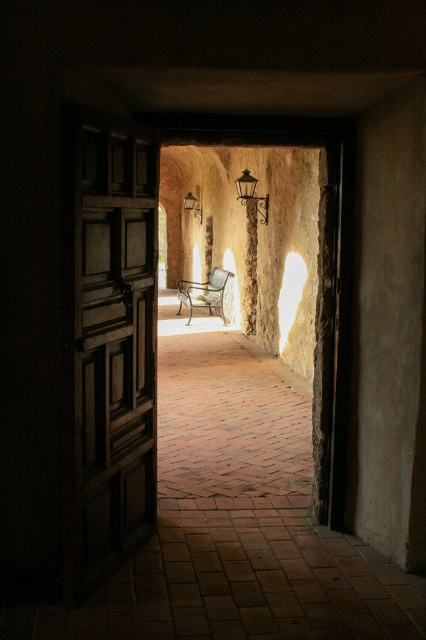
Does dark brown wrought iron lamp at center lie in front of matte black lamp at center?

Yes, it is in front of matte black lamp at center.

Can you confirm if dark brown wrought iron lamp at center is shorter than matte black lamp at center?

Correct, dark brown wrought iron lamp at center is not as tall as matte black lamp at center.

Between point (250, 182) and point (187, 205), which one is positioned behind?

Point (187, 205)

Identify the location of dark brown wrought iron lamp at center. The image size is (426, 640). (252, 195).

Is metallic/golden bench at center shorter than matte black lamp at center?

No.

Does point (219, 284) lie behind point (190, 200)?

No.

This screenshot has width=426, height=640. Find the location of `metallic/golden bench at center`. metallic/golden bench at center is located at coordinates (204, 292).

Between point (252, 218) and point (241, 196), which one is positioned in front?

Point (241, 196) is more forward.

Does smooth stone pillar at center have a lesser height compared to dark brown wrought iron lamp at center?

In fact, smooth stone pillar at center may be taller than dark brown wrought iron lamp at center.

Describe the element at coordinates (250, 268) in the screenshot. I see `smooth stone pillar at center` at that location.

You are a GUI agent. You are given a task and a screenshot of the screen. Output one action in this format:
    pyautogui.click(x=<x>, y=<y>)
    Task: Click on the smooth stone pillar at center
    The width and height of the screenshot is (426, 640).
    Given the screenshot: What is the action you would take?
    pyautogui.click(x=250, y=268)